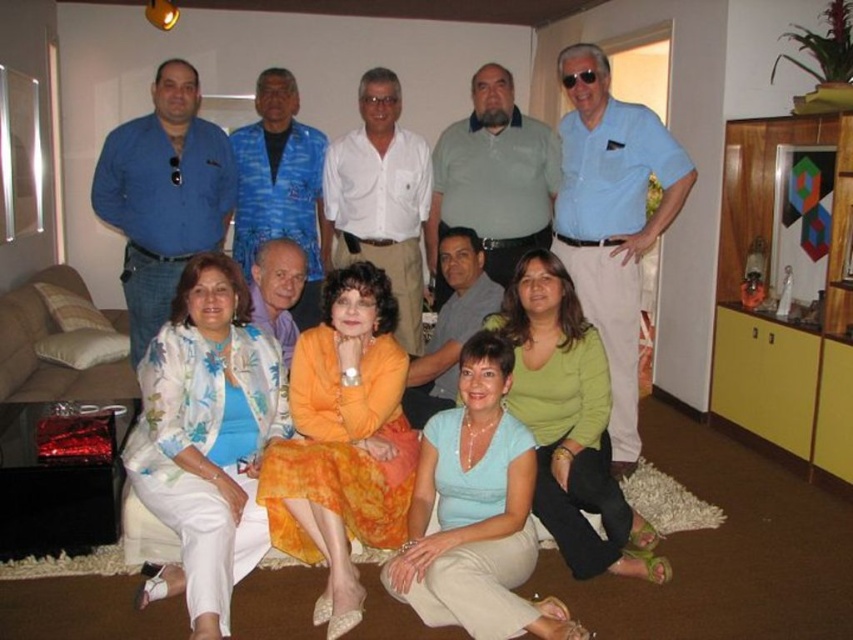
Question: Based on their relative distances, which object is nearer to the light blue jersey at center?

Choices:
 (A) light blue fabric blouse at lower center
 (B) orange satin dress at center
 (C) floral print fabric blouse at lower left
 (D) floral fabric jacket at center

Answer: (B)

Question: Does floral print fabric blouse at lower left have a greater width compared to light blue fabric blouse at lower center?

Choices:
 (A) yes
 (B) no

Answer: (B)

Question: Is floral fabric jacket at center smaller than light blue jersey at center?

Choices:
 (A) yes
 (B) no

Answer: (B)

Question: Estimate the real-world distances between objects in this image. Which object is farther from the orange satin dress at center?

Choices:
 (A) light blue fabric blouse at lower center
 (B) light blue jersey at center
 (C) floral fabric jacket at center
 (D) floral print fabric blouse at lower left

Answer: (C)

Question: Does orange satin dress at center appear on the right side of light blue jersey at center?

Choices:
 (A) no
 (B) yes

Answer: (A)

Question: Which point is closer to the camera?

Choices:
 (A) (248, 513)
 (B) (405, 157)
 (C) (430, 595)

Answer: (C)